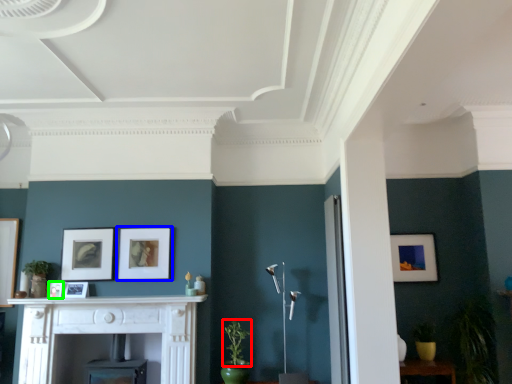
Question: Which object is positioned farthest from plant (highlighted by a red box)? Select from picture frame (highlighted by a blue box) and picture frame (highlighted by a green box).

Choices:
 (A) picture frame
 (B) picture frame

Answer: (B)